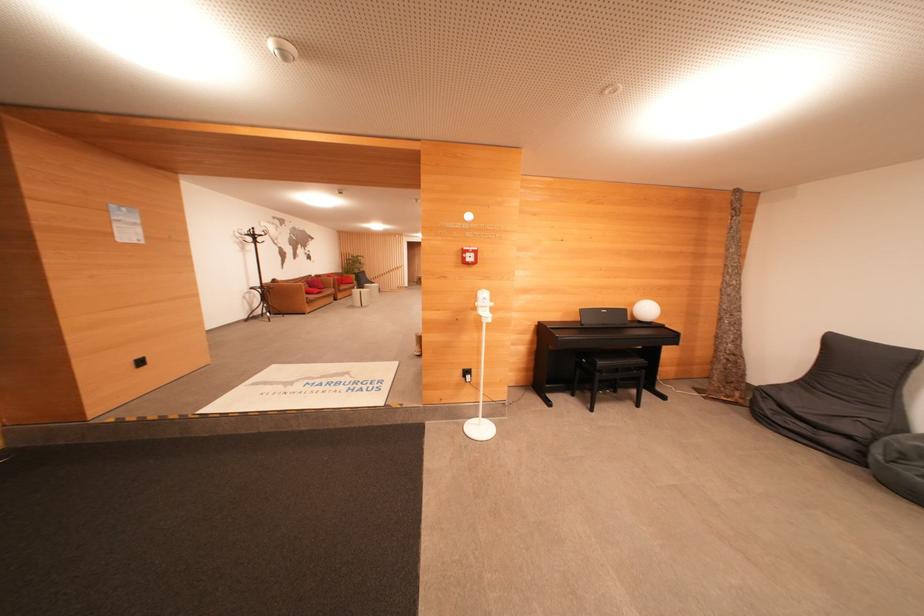
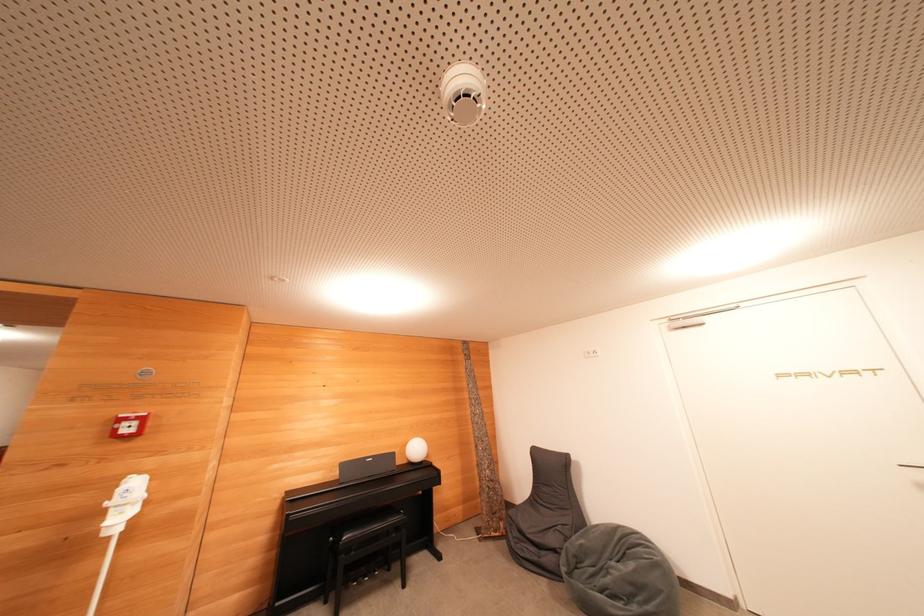
The point at [477,257] is marked in the first image. Where is the corresponding point in the second image?

(139, 427)